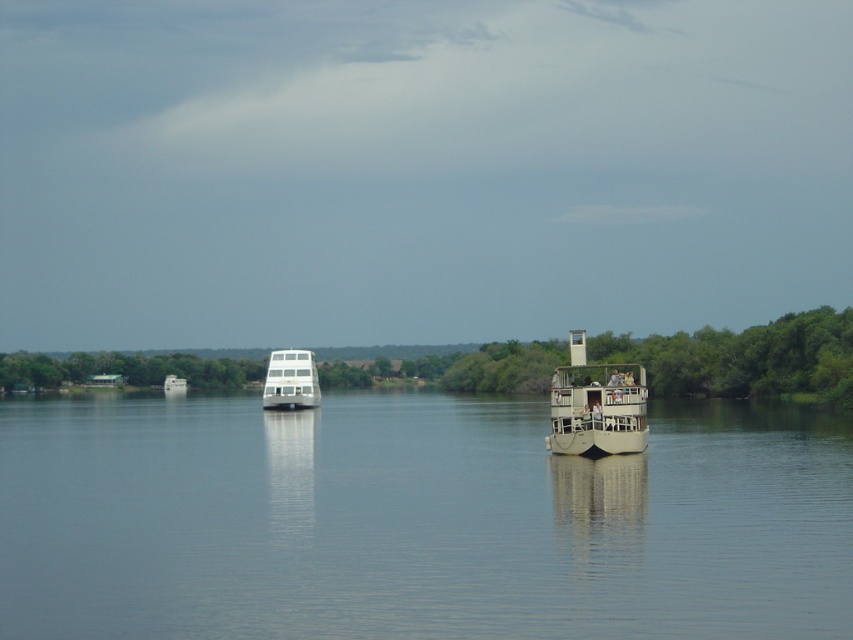
Question: Considering the real-world distances, which object is farthest from the smooth water at center?

Choices:
 (A) white glossy boat at center
 (B) beige wooden boat at center

Answer: (A)

Question: Which point appears closest to the camera in this image?

Choices:
 (A) (618, 614)
 (B) (271, 401)
 (C) (604, 388)

Answer: (A)

Question: Is smooth water at center in front of white glossy boat at center?

Choices:
 (A) yes
 (B) no

Answer: (A)

Question: Which is nearer to the smooth water at center?

Choices:
 (A) beige wooden boat at center
 (B) white glossy boat at center

Answer: (A)

Question: Is the position of smooth water at center more distant than that of white glossy boat at center?

Choices:
 (A) yes
 (B) no

Answer: (B)

Question: From the image, what is the correct spatial relationship of smooth water at center in relation to white glossy boat at center?

Choices:
 (A) left
 (B) right

Answer: (B)